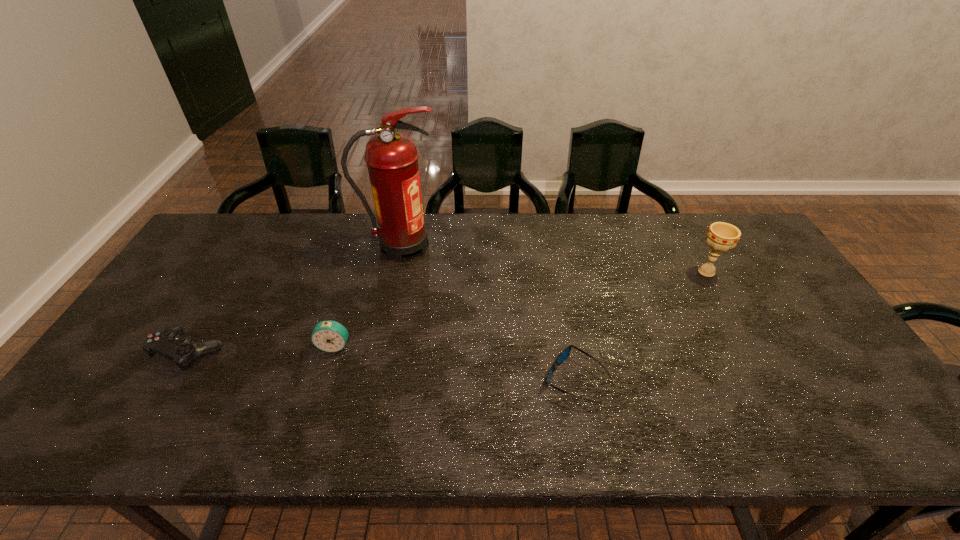
This screenshot has height=540, width=960. In the image, there is a desktop. What are the coordinates of `vacant space at the left edge` in the screenshot? It's located at (148, 374).

You are a GUI agent. You are given a task and a screenshot of the screen. Output one action in this format:
    pyautogui.click(x=<x>, y=<y>)
    Task: Click on the free space at the right edge of the desktop
    Image resolution: width=960 pixels, height=540 pixels.
    Given the screenshot: What is the action you would take?
    pyautogui.click(x=807, y=365)

Image resolution: width=960 pixels, height=540 pixels. I want to click on vacant area at the far left corner, so click(x=229, y=243).

The height and width of the screenshot is (540, 960). I want to click on vacant space at the far right corner of the desktop, so click(x=704, y=230).

Identify the location of blank space at the near right corner. Image resolution: width=960 pixels, height=540 pixels. (887, 428).

Locate an element on the screen. The width and height of the screenshot is (960, 540). empty space that is in between the fourth object from left to right and the chalice is located at coordinates [641, 326].

The width and height of the screenshot is (960, 540). I want to click on unoccupied area between the tallest object and the sunglasses, so coord(489,313).

The width and height of the screenshot is (960, 540). I want to click on free spot between the fourth nearest object and the tallest object, so click(554, 259).

The image size is (960, 540). I want to click on empty space that is in between the second object from right to left and the control, so click(383, 366).

You are a GUI agent. You are given a task and a screenshot of the screen. Output one action in this format:
    pyautogui.click(x=<x>, y=<y>)
    Task: Click on the free spot between the leftmost object and the third shortest object
    The width and height of the screenshot is (960, 540).
    Given the screenshot: What is the action you would take?
    pyautogui.click(x=262, y=348)